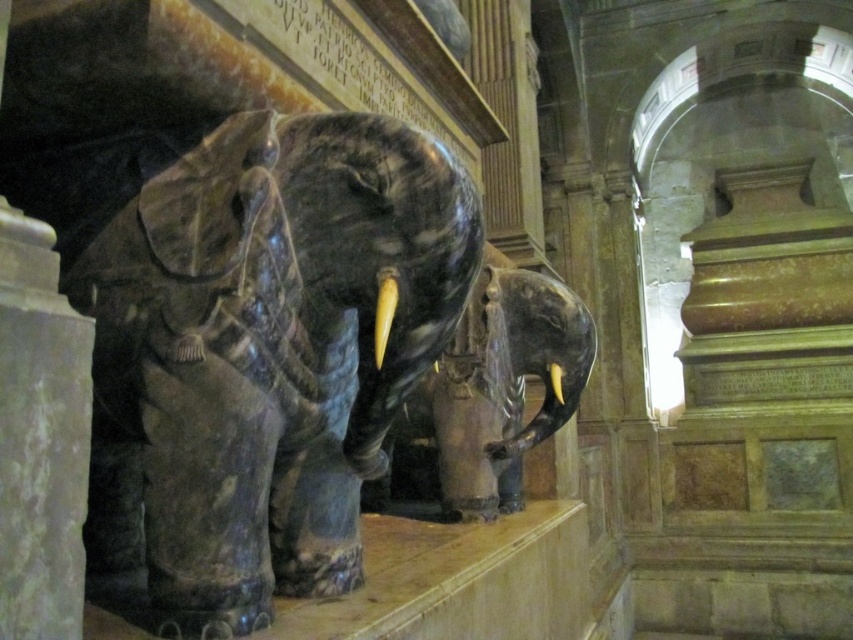
You are an architect inspecting the interior of a cathedral. You notice the white marble pillar at left and the shiny black elephant at center. Which object is taller?

The shiny black elephant at center is taller than the white marble pillar at left.

You are an interior designer planning to install a new lighting fixture. You have two options based on the objects in the scene. The first option is a spotlight for the white marble pillar at left, and the second is a larger chandelier for the shiny black elephant at center. Which object requires the larger lighting fixture based on their sizes?

The shiny black elephant at center requires the larger chandelier because it is bigger than the white marble pillar at left.